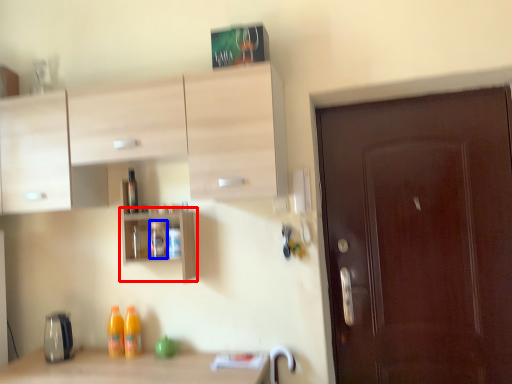
Question: Which of the following is the farthest to the observer, shelf (highlighted by a red box) or bottle (highlighted by a blue box)?

Choices:
 (A) shelf
 (B) bottle

Answer: (B)